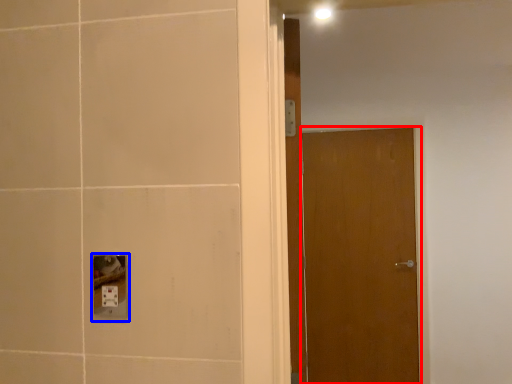
Question: Which point is closer to the camera, door (highlighted by a red box) or socket (highlighted by a blue box)?

Choices:
 (A) door
 (B) socket

Answer: (B)